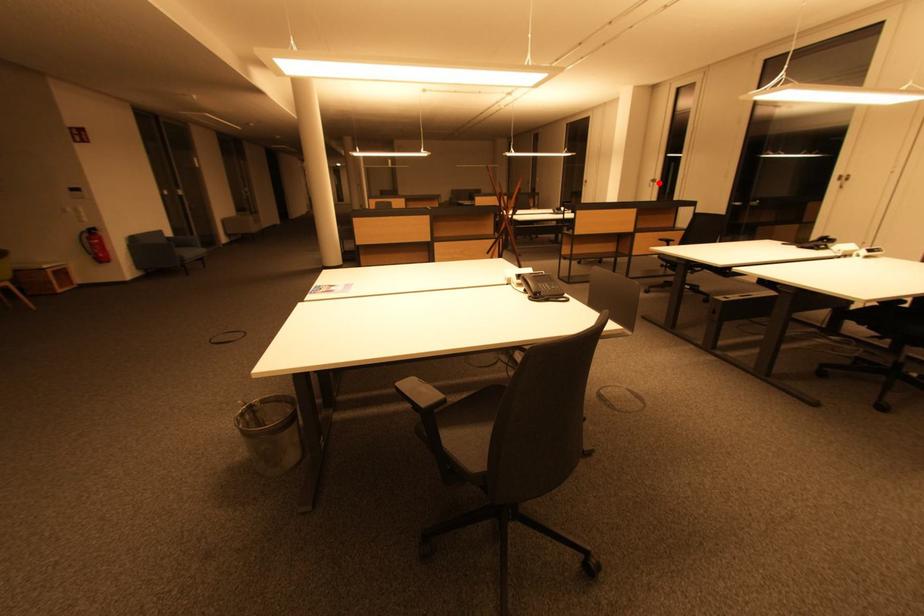
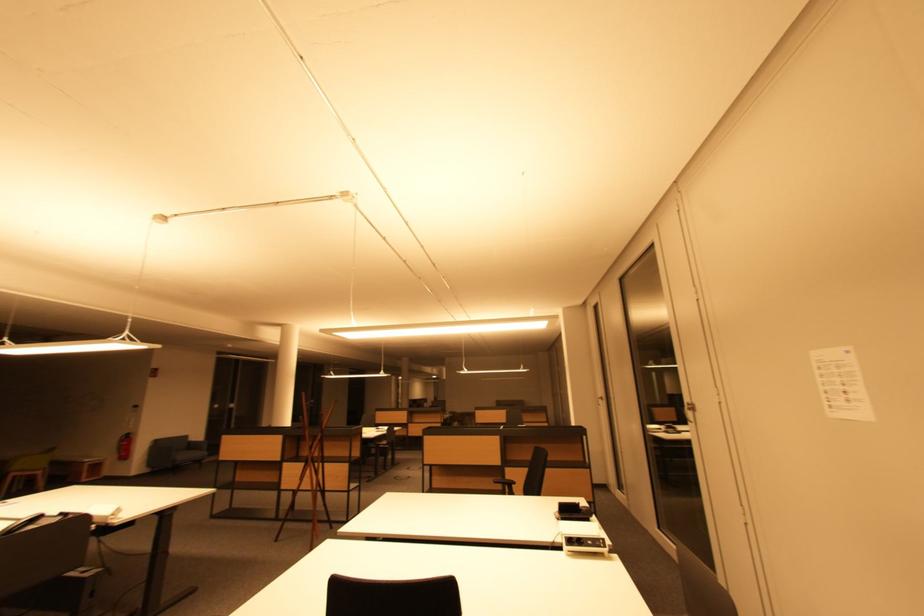
Locate, in the second image, the point that corresponds to the highlighted location in the first image.

(605, 400)